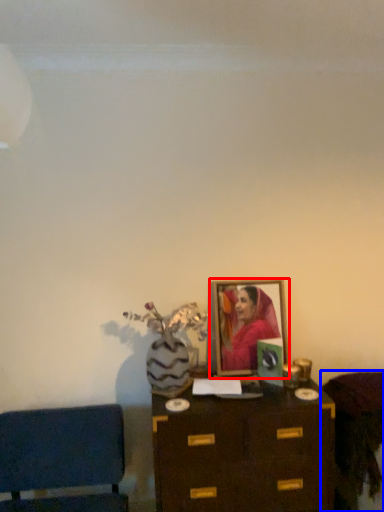
Question: Among these objects, which one is farthest to the camera, picture frame (highlighted by a red box) or furniture (highlighted by a blue box)?

Choices:
 (A) picture frame
 (B) furniture

Answer: (A)